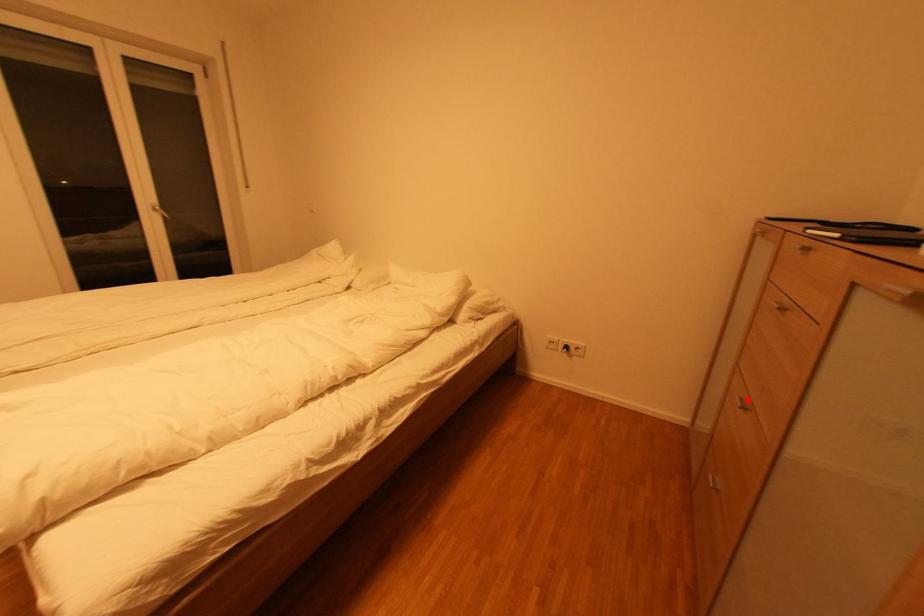
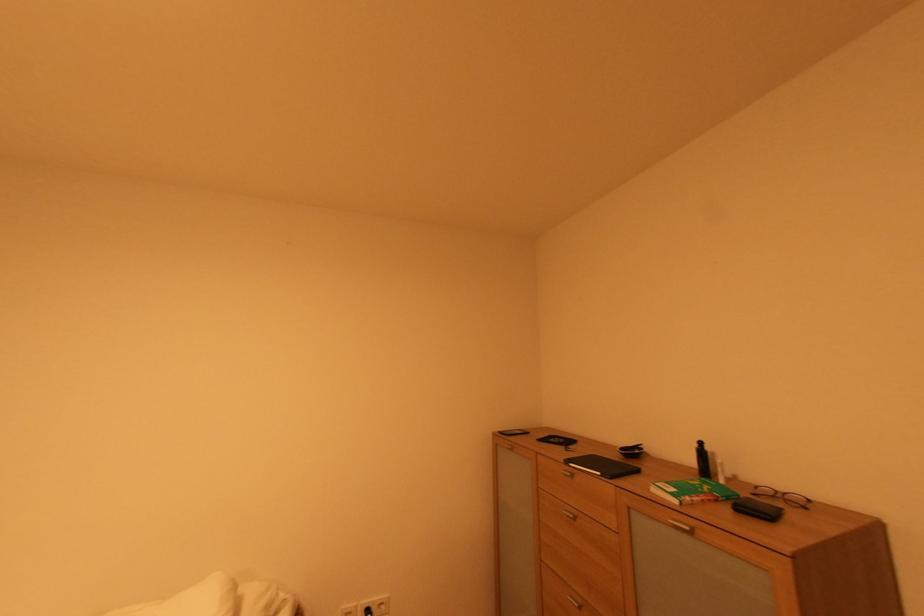
The point at the highlighted location is marked in the first image. Where is the corresponding point in the second image?

(578, 599)